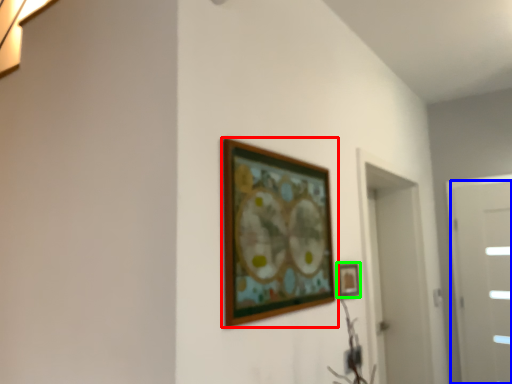
Question: Which object is positioned closest to picture frame (highlighted by a red box)? Select from door (highlighted by a blue box) and picture frame (highlighted by a green box).

Choices:
 (A) door
 (B) picture frame

Answer: (B)